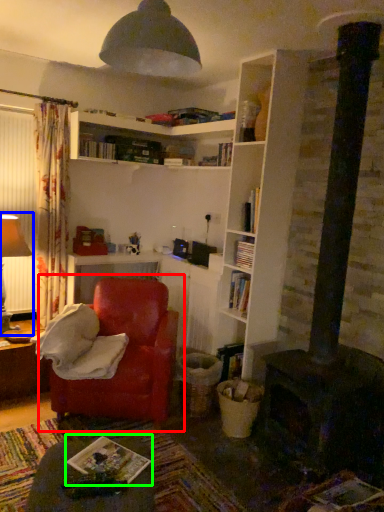
Question: Based on their relative distances, which object is nearer to chair (highlighted by a red box)? Choose from table lamp (highlighted by a blue box) and book (highlighted by a green box).

Choices:
 (A) table lamp
 (B) book

Answer: (B)